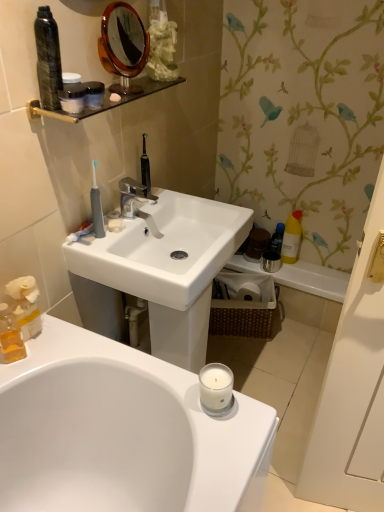
The image size is (384, 512). I want to click on free space behind white matte soap at center, so click(139, 207).